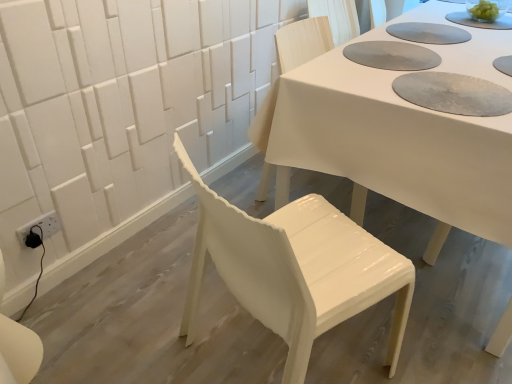
In order to click on vacant area that is in front of textured gray paper plate at upper center in this screenshot , I will do `click(421, 83)`.